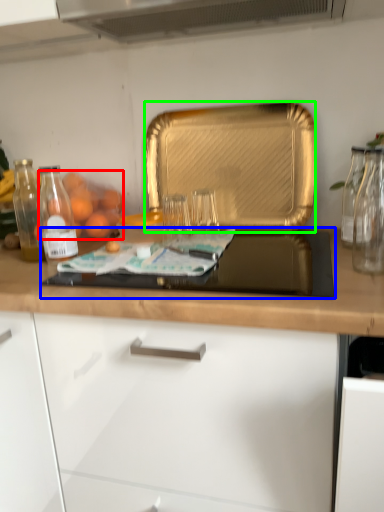
Question: Based on their relative distances, which object is nearer to fruit (highlighted by a red box)? Choose from gas stove (highlighted by a blue box) and kitchen appliance (highlighted by a green box).

Choices:
 (A) gas stove
 (B) kitchen appliance

Answer: (B)